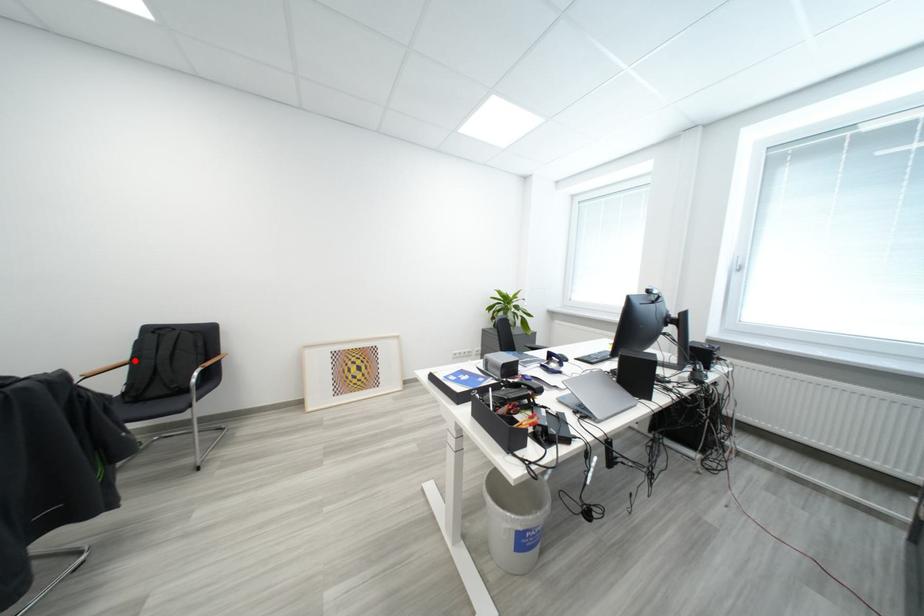
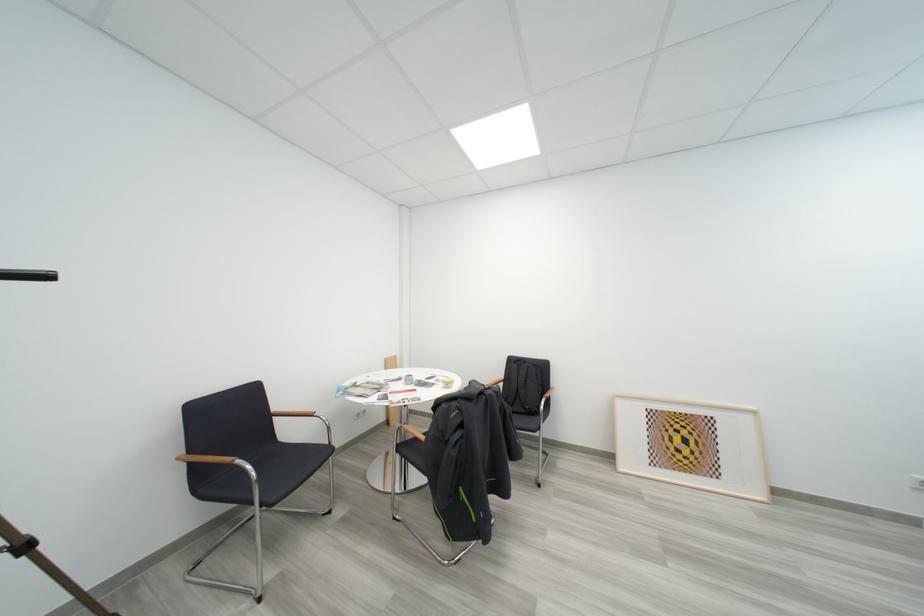
In the second image, find the point that corresponds to the highlighted location in the first image.

(512, 381)